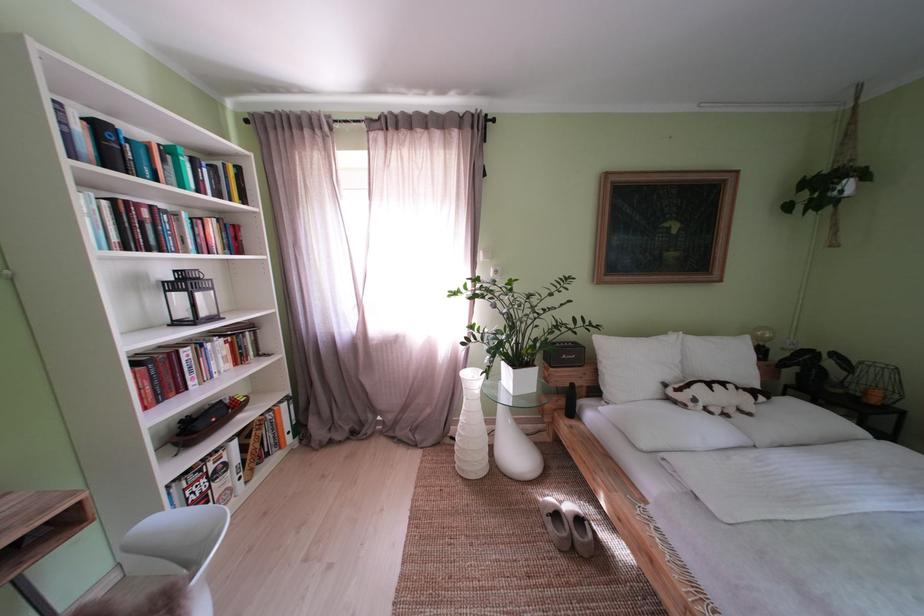
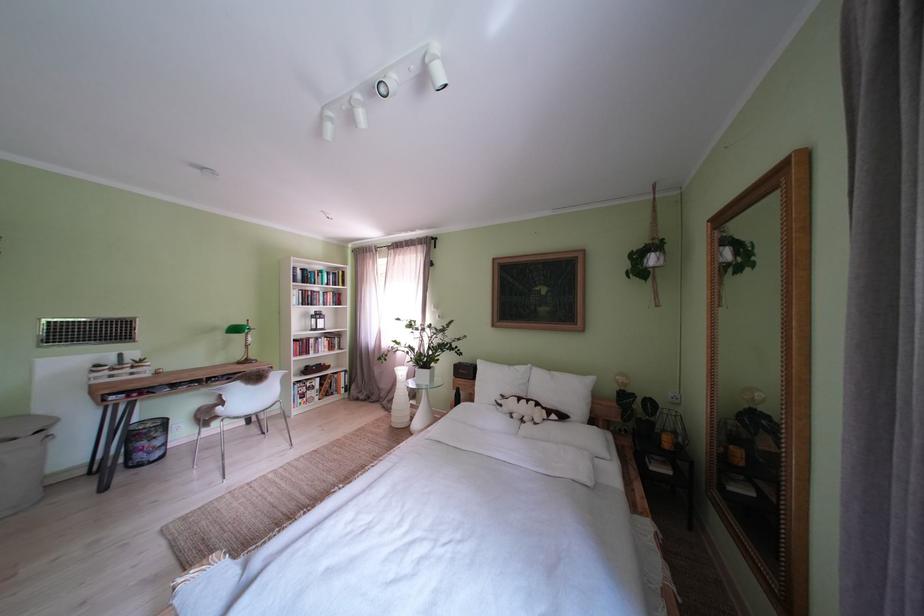
The point at (706, 406) is marked in the first image. Where is the corresponding point in the second image?

(512, 411)